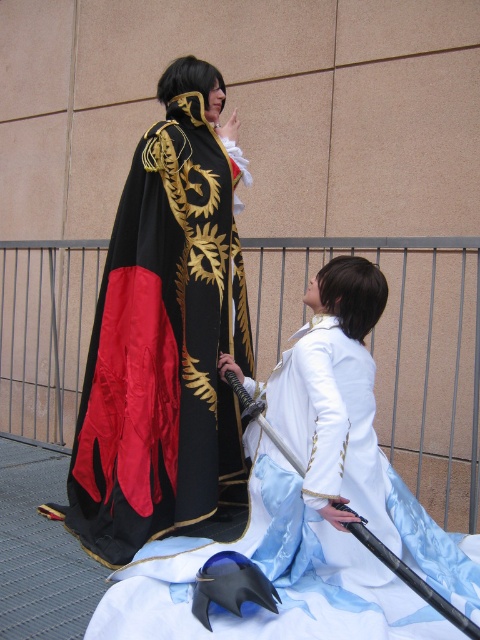
Question: Which object is closer to the camera taking this photo?

Choices:
 (A) satin white dress at center
 (B) velvet black cape at center

Answer: (A)

Question: Does velvet black cape at center appear under satin white dress at center?

Choices:
 (A) no
 (B) yes

Answer: (A)

Question: Which of the following is the farthest from the observer?

Choices:
 (A) (121, 605)
 (B) (182, 97)

Answer: (B)

Question: Is velvet black cape at center thinner than satin white dress at center?

Choices:
 (A) no
 (B) yes

Answer: (B)

Question: Is velvet black cape at center thinner than satin white dress at center?

Choices:
 (A) no
 (B) yes

Answer: (B)

Question: Which object is farther from the camera taking this photo?

Choices:
 (A) velvet black cape at center
 (B) satin white dress at center

Answer: (A)